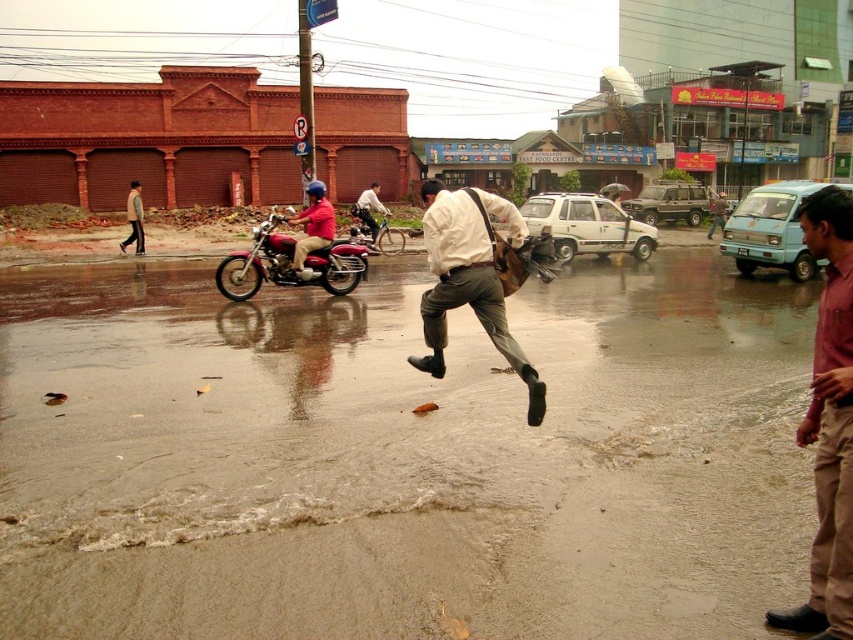
At what (x,y) coordinates should I click in order to perform the action: click on brown cotton pants at right. Please return your answer as a coordinate pair (x, y). The image size is (853, 640). Looking at the image, I should click on (828, 422).

Can you confirm if brown cotton pants at right is taller than light brown leather bag at center?

No.

Image resolution: width=853 pixels, height=640 pixels. What do you see at coordinates (828, 422) in the screenshot?
I see `brown cotton pants at right` at bounding box center [828, 422].

Locate an element on the screen. brown cotton pants at right is located at coordinates (828, 422).

Can you confirm if brown cotton pants at right is thinner than matte red motorcycle at center?

Yes.

Between brown cotton pants at right and matte red motorcycle at center, which one is positioned lower?

brown cotton pants at right

Between point (833, 417) and point (363, 193), which one is positioned behind?

The point (363, 193) is behind.

Where is `brown cotton pants at right`? The image size is (853, 640). brown cotton pants at right is located at coordinates (828, 422).

Is point (813, 225) less distant than point (390, 240)?

Yes, point (813, 225) is closer to viewer.

Based on the photo, is brown cotton pants at right positioned at the back of shiny chrome motorcycle at center?

No.

Where is `brown cotton pants at right`? This screenshot has width=853, height=640. brown cotton pants at right is located at coordinates (828, 422).